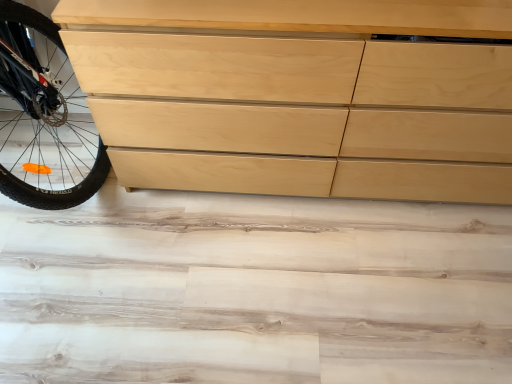
The width and height of the screenshot is (512, 384). What are the coordinates of `vacant area that is in front of natural wood chest of drawers at left` in the screenshot? It's located at (326, 286).